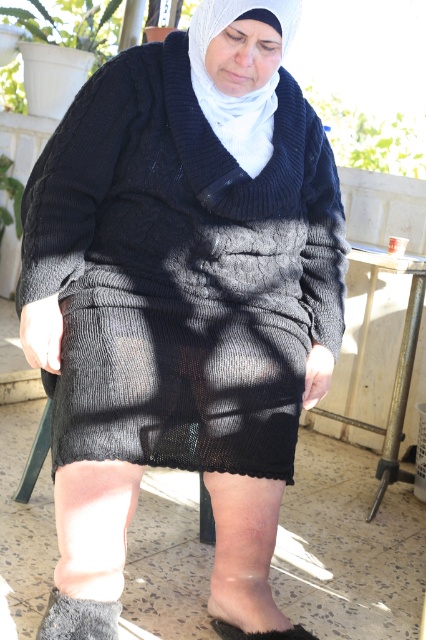
Question: Among these points, which one is nearest to the camera?

Choices:
 (A) (109, 628)
 (B) (227, 624)

Answer: (A)

Question: Which point is closer to the camera?

Choices:
 (A) gray fuzzy sock at lower left
 (B) gray fabric foot at lower center

Answer: (A)

Question: Is white knitted headscarf at center to the left of gray fuzzy sock at lower left from the viewer's perspective?

Choices:
 (A) no
 (B) yes

Answer: (A)

Question: Which point is farther to the camera?

Choices:
 (A) white knitted headscarf at center
 (B) gray fabric foot at lower center

Answer: (B)

Question: Does gray fuzzy sock at lower left have a smaller size compared to gray fabric foot at lower center?

Choices:
 (A) yes
 (B) no

Answer: (A)

Question: Can you confirm if gray fuzzy sock at lower left is bigger than gray fabric foot at lower center?

Choices:
 (A) yes
 (B) no

Answer: (B)